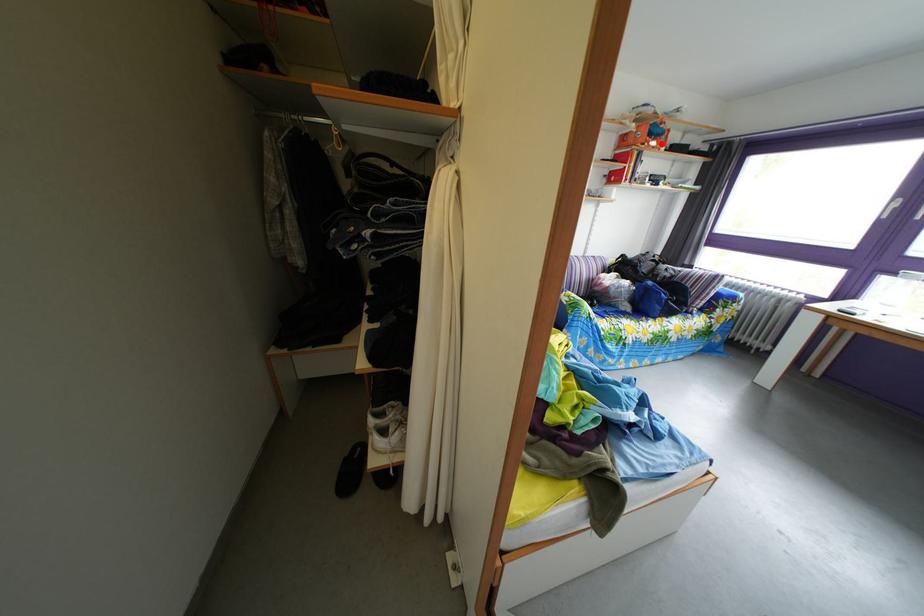
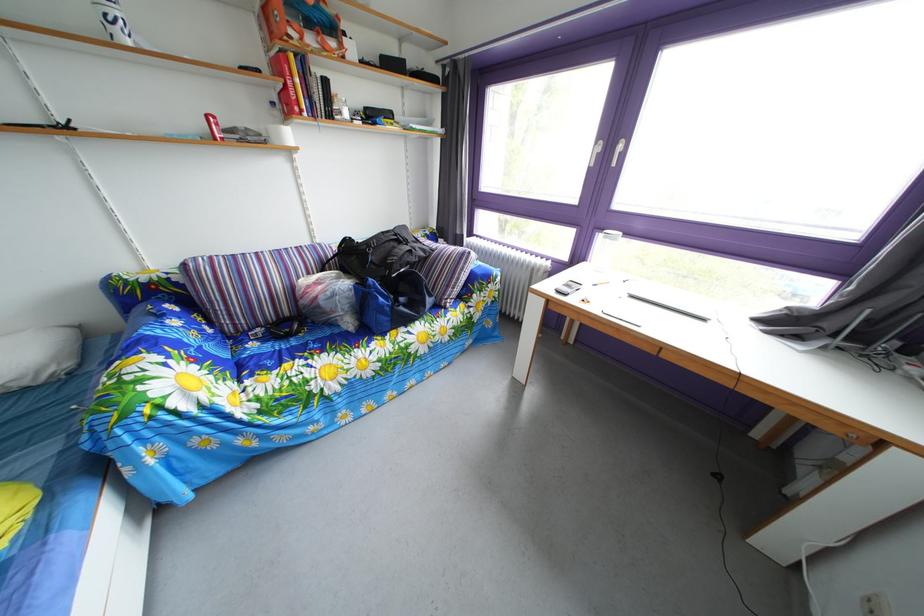
The point at the highlighted location is marked in the first image. Where is the corresponding point in the second image?

(320, 33)